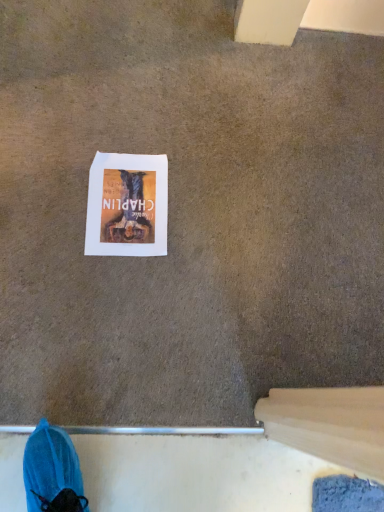
In order to face white paper at center, should I rotate leftwards or rightwards?

To face it directly, rotate left by 9.076 degrees.

Identify the location of white paper at center. The image size is (384, 512). (127, 205).

What do you see at coordinates (127, 205) in the screenshot? I see `white paper at center` at bounding box center [127, 205].

At what (x,y) coordinates should I click in order to perform the action: click on white paper at center. Please return your answer as a coordinate pair (x, y). Image resolution: width=384 pixels, height=512 pixels. Looking at the image, I should click on (127, 205).